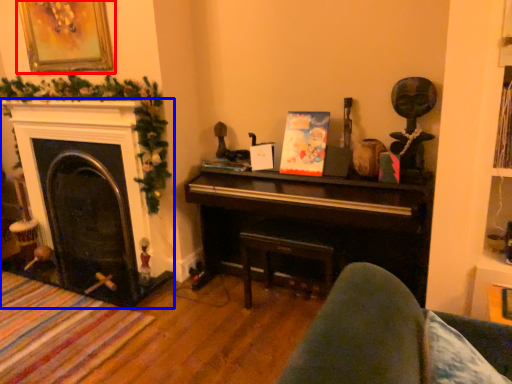
Question: Which point is further to the camera, picture frame (highlighted by a red box) or fireplace (highlighted by a blue box)?

Choices:
 (A) picture frame
 (B) fireplace

Answer: (B)